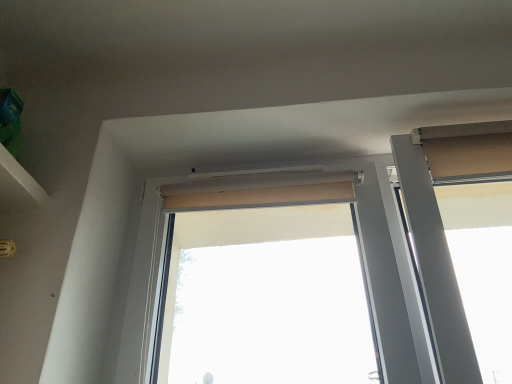
Describe the element at coordinates (18, 185) in the screenshot. This screenshot has width=512, height=384. I see `white matte window sill at upper left` at that location.

What are the coordinates of `white matte window sill at upper left` in the screenshot? It's located at (18, 185).

You are a GUI agent. You are given a task and a screenshot of the screen. Output one action in this format:
    pyautogui.click(x=<x>, y=<y>)
    Task: Click on the white matte window sill at upper left
    Image resolution: width=512 pixels, height=384 pixels.
    Given the screenshot: What is the action you would take?
    pyautogui.click(x=18, y=185)